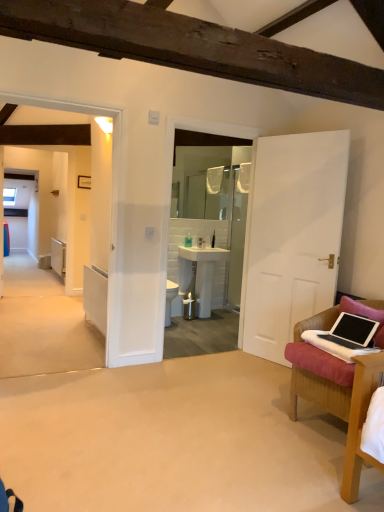
Question: Looking at their shapes, would you say metallic silver trash can at center is wider or thinner than white glossy sink at center?

Choices:
 (A) thin
 (B) wide

Answer: (A)

Question: Considering the positions of metallic silver trash can at center and white glossy sink at center in the image, is metallic silver trash can at center taller or shorter than white glossy sink at center?

Choices:
 (A) short
 (B) tall

Answer: (A)

Question: Based on their relative distances, which object is farther from the black matte laptop at lower right?

Choices:
 (A) metallic silver trash can at center
 (B) white frosted glass mirror at center
 (C) pink fabric pillow at right
 (D) white glossy sink at center
 (E) translucent plastic bottle at center

Answer: (B)

Question: Estimate the real-world distances between objects in this image. Which object is closer to the metallic silver trash can at center?

Choices:
 (A) translucent plastic bottle at center
 (B) white matte door at right
 (C) white glossy sink at center
 (D) leather-like brown chair at lower right
 (E) white frosted glass mirror at center

Answer: (C)